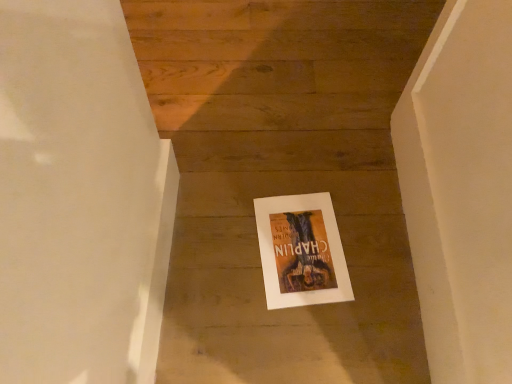
The image size is (512, 384). In order to click on free space to the back side of white paper at center in this screenshot , I will do `click(296, 163)`.